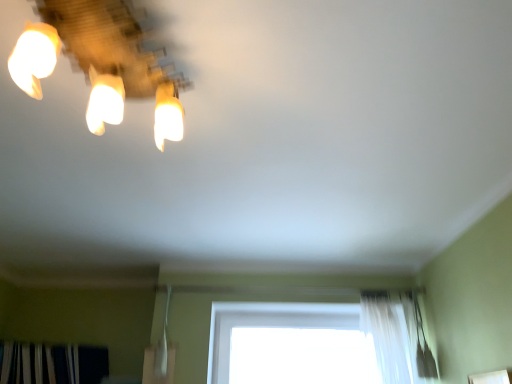
Question: Is matte glass lamp at upper left surrounded by white sheer curtain at lower right?

Choices:
 (A) no
 (B) yes

Answer: (A)

Question: Considering the relative sizes of white sheer curtain at lower right and matte glass lamp at upper left in the image provided, is white sheer curtain at lower right taller than matte glass lamp at upper left?

Choices:
 (A) yes
 (B) no

Answer: (A)

Question: From the image's perspective, is white sheer curtain at lower right below matte glass lamp at upper left?

Choices:
 (A) no
 (B) yes

Answer: (B)

Question: Considering the relative sizes of white sheer curtain at lower right and matte glass lamp at upper left in the image provided, is white sheer curtain at lower right shorter than matte glass lamp at upper left?

Choices:
 (A) no
 (B) yes

Answer: (A)

Question: Is white sheer curtain at lower right at the left side of matte glass lamp at upper left?

Choices:
 (A) yes
 (B) no

Answer: (B)

Question: From their relative heights in the image, would you say matte glass lamp at upper left is taller or shorter than dark green textured curtain at lower left?

Choices:
 (A) tall
 (B) short

Answer: (A)

Question: Does point (65, 9) appear closer or farther from the camera than point (64, 362)?

Choices:
 (A) closer
 (B) farther

Answer: (A)

Question: From a real-world perspective, is matte glass lamp at upper left positioned above or below dark green textured curtain at lower left?

Choices:
 (A) below
 (B) above

Answer: (B)

Question: Is matte glass lamp at upper left spatially inside dark green textured curtain at lower left, or outside of it?

Choices:
 (A) outside
 (B) inside

Answer: (A)

Question: From the image's perspective, is dark green textured curtain at lower left located above or below white sheer curtain at lower right?

Choices:
 (A) below
 (B) above

Answer: (A)

Question: Does point (62, 357) appear closer or farther from the camera than point (398, 345)?

Choices:
 (A) closer
 (B) farther

Answer: (B)

Question: Is dark green textured curtain at lower left wider or thinner than white sheer curtain at lower right?

Choices:
 (A) wide
 (B) thin

Answer: (A)

Question: In terms of size, does dark green textured curtain at lower left appear bigger or smaller than white sheer curtain at lower right?

Choices:
 (A) small
 (B) big

Answer: (B)

Question: From the image's perspective, relative to matte glass lamp at upper left, is white sheer curtain at lower right above or below?

Choices:
 (A) above
 (B) below

Answer: (B)

Question: In the image, is white sheer curtain at lower right positioned in front of or behind matte glass lamp at upper left?

Choices:
 (A) front
 (B) behind

Answer: (B)